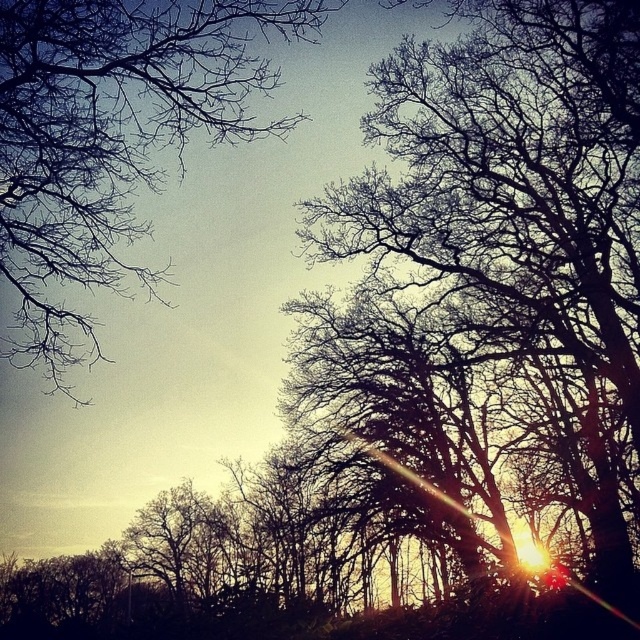
Question: Which object is farther from the camera taking this photo?

Choices:
 (A) bare branches at upper left
 (B) silhouette bare branches at center

Answer: (B)

Question: Does silhouette bare branches at center have a larger size compared to bare branches at upper left?

Choices:
 (A) yes
 (B) no

Answer: (B)

Question: Which point is closer to the camera?

Choices:
 (A) (595, 134)
 (B) (125, 228)

Answer: (B)

Question: Which point appears closest to the camera in this image?

Choices:
 (A) (76, 314)
 (B) (394, 147)

Answer: (A)

Question: Considering the relative positions of silhouette bare branches at center and bare branches at upper left in the image provided, where is silhouette bare branches at center located with respect to bare branches at upper left?

Choices:
 (A) left
 (B) right

Answer: (B)

Question: Can you confirm if silhouette bare branches at center is positioned below bare branches at upper left?

Choices:
 (A) yes
 (B) no

Answer: (A)